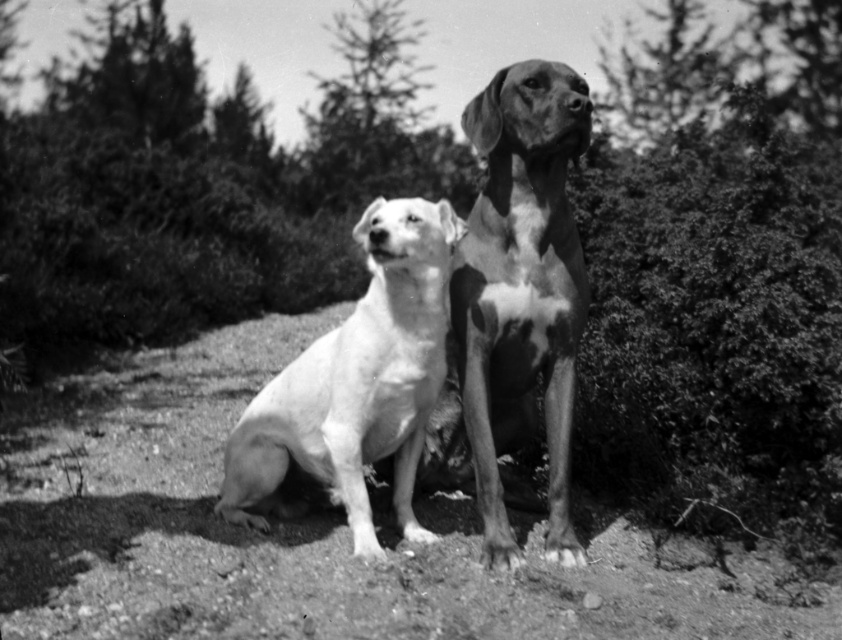
Question: Among these points, which one is nearest to the camera?

Choices:
 (A) (496, 307)
 (B) (360, 532)

Answer: (B)

Question: Does spotted fur dog at center come behind white smooth dog at center?

Choices:
 (A) yes
 (B) no

Answer: (A)

Question: Is spotted fur dog at center bigger than white smooth dog at center?

Choices:
 (A) yes
 (B) no

Answer: (B)

Question: Which object appears closest to the camera in this image?

Choices:
 (A) white smooth dog at center
 (B) spotted fur dog at center

Answer: (A)

Question: Does spotted fur dog at center have a lesser width compared to white smooth dog at center?

Choices:
 (A) yes
 (B) no

Answer: (A)